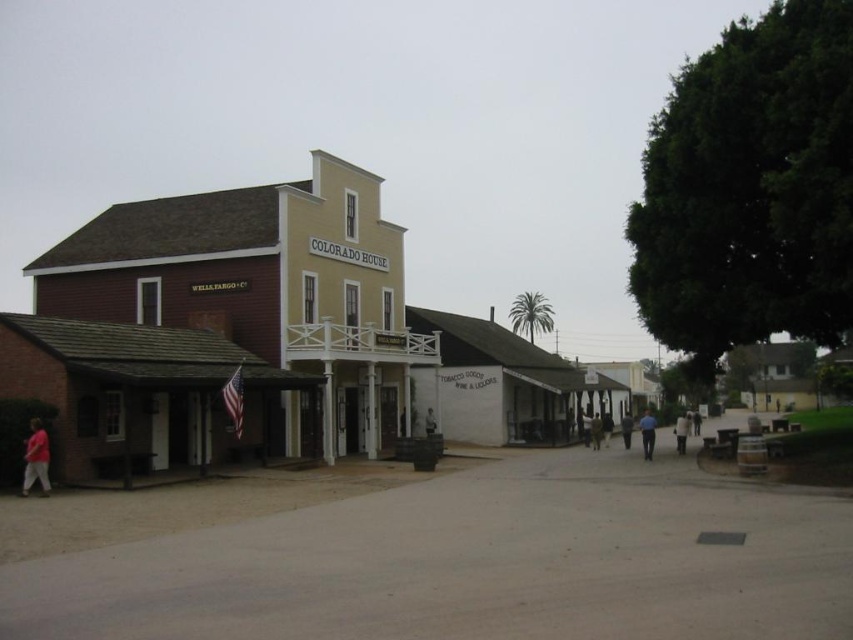
Who is shorter, pink fabric shirt at lower left or light brown leather jacket at center?

With less height is pink fabric shirt at lower left.

Measure the distance between pink fabric shirt at lower left and camera.

pink fabric shirt at lower left is 17.76 meters away from camera.

At what (x,y) coordinates should I click in order to perform the action: click on pink fabric shirt at lower left. Please return your answer as a coordinate pair (x, y). Looking at the image, I should click on (36, 458).

Which is below, blue uniform at center or light brown leather jacket at center?

light brown leather jacket at center

Where is `blue uniform at center`? blue uniform at center is located at coordinates (647, 433).

Who is positioned more to the right, pink fabric shirt at lower left or blue uniform at center?

From the viewer's perspective, blue uniform at center appears more on the right side.

Identify the location of pink fabric shirt at lower left. This screenshot has width=853, height=640. (36, 458).